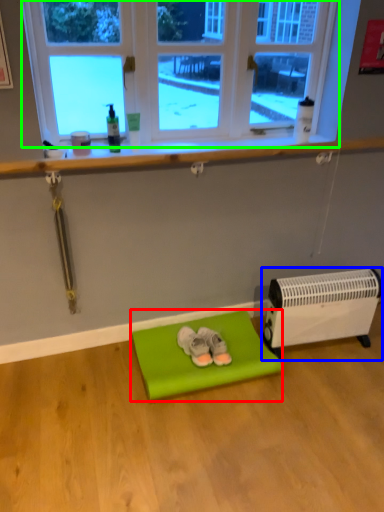
Question: Which is nearer to the furniture (highlighted by a red box)? heater (highlighted by a blue box) or window (highlighted by a green box).

Choices:
 (A) heater
 (B) window

Answer: (A)